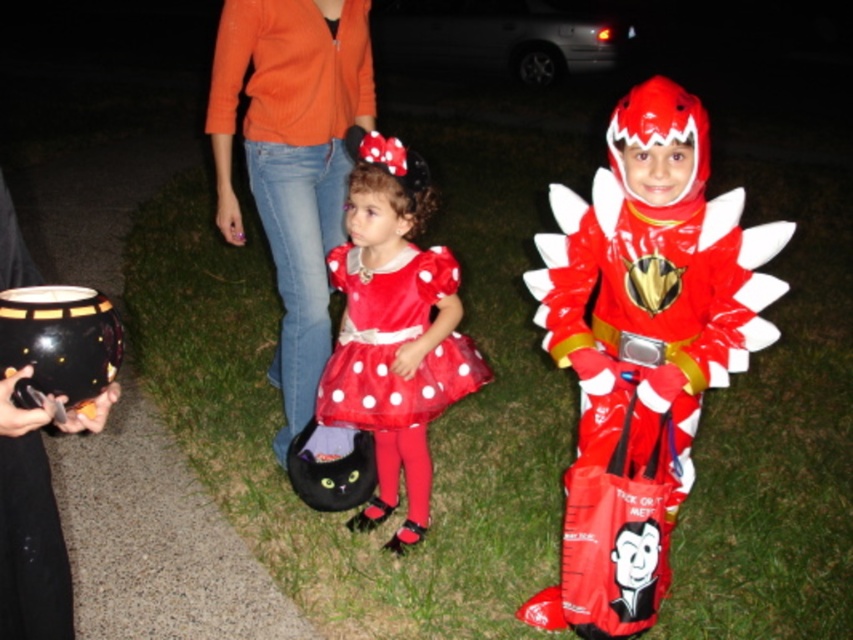
In the scene shown: Is orange cotton sweater at upper center positioned before shiny satin dress at center?

That is False.

Does point (316, 381) lie in front of point (432, 419)?

No, (316, 381) is further to viewer.

Who is more distant from viewer, [323,221] or [425,365]?

Positioned behind is point [323,221].

The height and width of the screenshot is (640, 853). Find the location of `orange cotton sweater at upper center`. orange cotton sweater at upper center is located at coordinates click(291, 160).

This screenshot has height=640, width=853. What do you see at coordinates (642, 348) in the screenshot?
I see `rubberized red dinosaur at right` at bounding box center [642, 348].

Can you confirm if rubberized red dinosaur at right is taller than orange cotton sweater at upper center?

No.

Which is behind, point (581, 506) or point (213, 80)?

Positioned behind is point (213, 80).

Find the location of a particular element. The width and height of the screenshot is (853, 640). rubberized red dinosaur at right is located at coordinates (642, 348).

Is point (659, 381) closer to camera compared to point (397, 260)?

Yes.

Does rubberized red dinosaur at right appear on the right side of red satin dress at center?

Yes, rubberized red dinosaur at right is to the right of red satin dress at center.

Which is behind, point (660, 304) or point (444, 272)?

The point (444, 272) is behind.

Where is `rubberized red dinosaur at right`? rubberized red dinosaur at right is located at coordinates (642, 348).